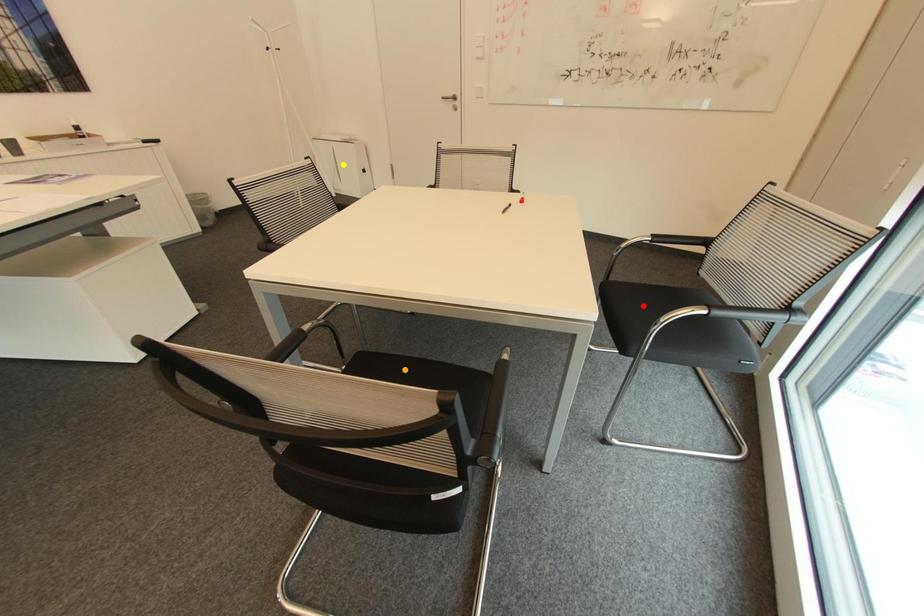
Order these from nearest to farthest:
red point, yellow point, orange point

yellow point, orange point, red point